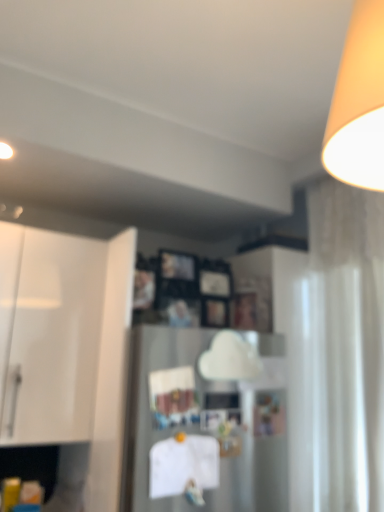
Measure the distance between point (370, 432) and camera.

Point (370, 432) and camera are 4.62 feet apart.

You are a GUI agent. You are given a task and a screenshot of the screen. Output one action in this format:
    pyautogui.click(x=<x>, y=<y>)
    Task: Click on the satin silver refrigerator at center
    This screenshot has width=384, height=512.
    Given the screenshot: What is the action you would take?
    point(208,423)

Which is closer to the camera, (50, 390) or (361, 333)?

Clearly, point (50, 390) is closer to the camera than point (361, 333).

From a real-world perspective, is white glossy cabinet at left above or below white sheer curtain at right?

white glossy cabinet at left is below white sheer curtain at right.

From the image's perspective, between white glossy cabinet at left and white sheer curtain at right, who is located below?

white sheer curtain at right appears lower in the image.

Is white glossy cabinet at left situated inside white sheer curtain at right or outside?

white glossy cabinet at left is located beyond the bounds of white sheer curtain at right.

Would you say satin silver refrigerator at center contains white sheer curtain at right?

No.

Between satin silver refrigerator at center and white sheer curtain at right, which one appears on the left side from the viewer's perspective?

From the viewer's perspective, satin silver refrigerator at center appears more on the left side.

From the image's perspective, relative to white sheer curtain at right, is satin silver refrigerator at center above or below?

From the image's perspective, satin silver refrigerator at center appears below white sheer curtain at right.

Is satin silver refrigerator at center not close to white glossy cabinet at left?

That's not correct — satin silver refrigerator at center is a little close to white glossy cabinet at left.

In the scene shown: Based on their sizes in the image, would you say satin silver refrigerator at center is bigger or smaller than white glossy cabinet at left?

Clearly, satin silver refrigerator at center is smaller in size than white glossy cabinet at left.

At what (x,y) coordinates should I click in order to perform the action: click on appliance that is in front of the white glossy cabinet at left. Please return your answer as a coordinate pair (x, y). The image size is (384, 512). Looking at the image, I should click on (208, 423).

Is satin silver refrigerator at center looking in the opposite direction of white glossy cabinet at left?

satin silver refrigerator at center does not have its back to white glossy cabinet at left.

In the scene shown: From the image's perspective, does white sheer curtain at right appear lower than satin silver refrigerator at center?

No, from the image's perspective, white sheer curtain at right is not below satin silver refrigerator at center.

Who is bigger, white sheer curtain at right or satin silver refrigerator at center?

white sheer curtain at right.

Is white sheer curtain at right not within satin silver refrigerator at center?

Yes, white sheer curtain at right is not within satin silver refrigerator at center.

How far apart are white sheer curtain at right and satin silver refrigerator at center?

white sheer curtain at right and satin silver refrigerator at center are 13.01 inches apart.

This screenshot has height=512, width=384. Find the location of `curtain lying on the right of white glossy cabinet at left`. curtain lying on the right of white glossy cabinet at left is located at coordinates (338, 355).

Between white sheer curtain at right and white glossy cabinet at left, which one is positioned in front?

white sheer curtain at right is more forward.

Considering the positions of point (294, 378) and point (42, 350), is point (294, 378) closer or farther from the camera than point (42, 350)?

Point (294, 378).

Is white sheer curtain at right to the left of white glossy cabinet at left from the viewer's perspective?

No.

Is satin silver refrigerator at center surrounded by white glossy cabinet at left?

No.

The height and width of the screenshot is (512, 384). Identify the location of appliance beneath the white glossy cabinet at left (from a real-world perspective). (208, 423).

Is white glossy cabinet at left wider than satin silver refrigerator at center?

Yes, white glossy cabinet at left is wider than satin silver refrigerator at center.

Does point (36, 410) appear closer or farther from the camera than point (177, 357)?

Point (36, 410) is positioned farther from the camera compared to point (177, 357).

Locate an element on the screen. This screenshot has width=384, height=512. cabinetry located underneath the white sheer curtain at right (from a real-world perspective) is located at coordinates (48, 334).

Find the location of a particular element. This screenshot has height=512, width=384. curtain that is above the satin silver refrigerator at center (from the image's perspective) is located at coordinates (338, 355).

When comparing their distances from satin silver refrigerator at center, does white glossy cabinet at left or white sheer curtain at right seem closer?

Based on the image, white sheer curtain at right appears to be nearer to satin silver refrigerator at center.

Based on the photo, which object lies nearer to the anchor point white glossy cabinet at left, white sheer curtain at right or satin silver refrigerator at center?

Among the two, satin silver refrigerator at center is located nearer to white glossy cabinet at left.

Which object lies further to the anchor point white glossy cabinet at left, satin silver refrigerator at center or white sheer curtain at right?

white sheer curtain at right.

Based on their spatial positions, is satin silver refrigerator at center or white glossy cabinet at left further from white sheer curtain at right?

Based on the image, white glossy cabinet at left appears to be further to white sheer curtain at right.

Based on their spatial positions, is white glossy cabinet at left or satin silver refrigerator at center closer to white sheer curtain at right?

Among the two, satin silver refrigerator at center is located nearer to white sheer curtain at right.

Considering their positions, is white sheer curtain at right positioned closer to satin silver refrigerator at center than white glossy cabinet at left?

Among the two, white sheer curtain at right is located nearer to satin silver refrigerator at center.

Locate an element on the screen. appliance located between white glossy cabinet at left and white sheer curtain at right in the left-right direction is located at coordinates (208, 423).